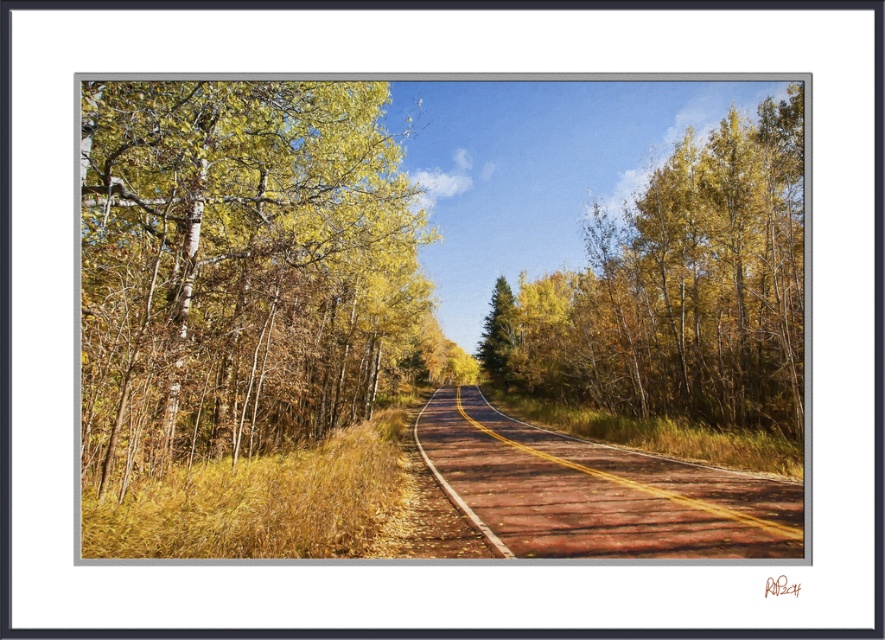
Can you confirm if yellow/golden bark trees at upper center is positioned to the left of brown wooden road at center?

In fact, yellow/golden bark trees at upper center is to the right of brown wooden road at center.

Does yellow/golden bark trees at upper center appear under brown wooden road at center?

Incorrect, yellow/golden bark trees at upper center is not positioned below brown wooden road at center.

Describe the element at coordinates (685, 288) in the screenshot. I see `yellow/golden bark trees at upper center` at that location.

Identify the location of yellow/golden bark trees at upper center. This screenshot has width=885, height=640. click(x=685, y=288).

Measure the distance from yellow/golden bark trees at upper center to green matte tree at center.

46.56 feet

Identify the location of yellow/golden bark trees at upper center. The width and height of the screenshot is (885, 640). (685, 288).

Measure the distance between point (x=745, y=140) and camera.

Point (x=745, y=140) is 28.12 meters away from camera.

I want to click on yellow/golden bark trees at upper center, so click(685, 288).

What do you see at coordinates (241, 269) in the screenshot?
I see `smooth bark birch at left` at bounding box center [241, 269].

Looking at this image, between smooth bark birch at left and yellow/golden bark trees at upper center, which one is positioned higher?

yellow/golden bark trees at upper center is above.

Measure the distance between point (x=401, y=180) and camera.

A distance of 19.60 meters exists between point (x=401, y=180) and camera.

Find the location of `smooth bark birch at left`. smooth bark birch at left is located at coordinates (241, 269).